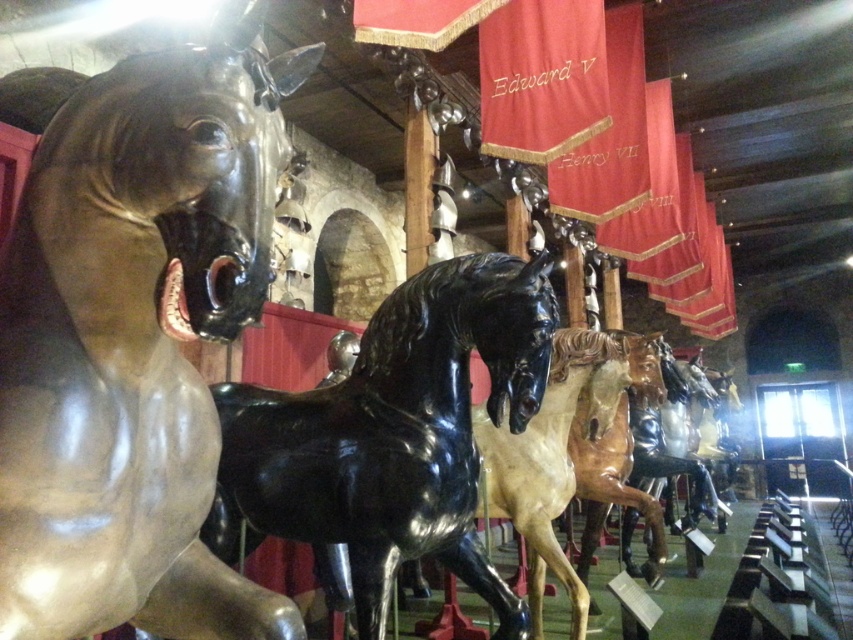
Question: Is shiny bronze horse at left smaller than glossy black horse at center?

Choices:
 (A) no
 (B) yes

Answer: (B)

Question: Where is shiny bronze horse at left located in relation to glossy black horse at center in the image?

Choices:
 (A) left
 (B) right

Answer: (A)

Question: Among these objects, which one is farthest from the camera?

Choices:
 (A) glossy black horse at center
 (B) shiny bronze horse at left

Answer: (A)

Question: Which point appears farthest from the camera in this image?

Choices:
 (A) click(506, 380)
 (B) click(18, 244)

Answer: (A)

Question: Which point is closer to the camera?

Choices:
 (A) glossy black horse at center
 (B) shiny bronze horse at left

Answer: (B)

Question: Is shiny bronze horse at left bigger than glossy black horse at center?

Choices:
 (A) no
 (B) yes

Answer: (A)